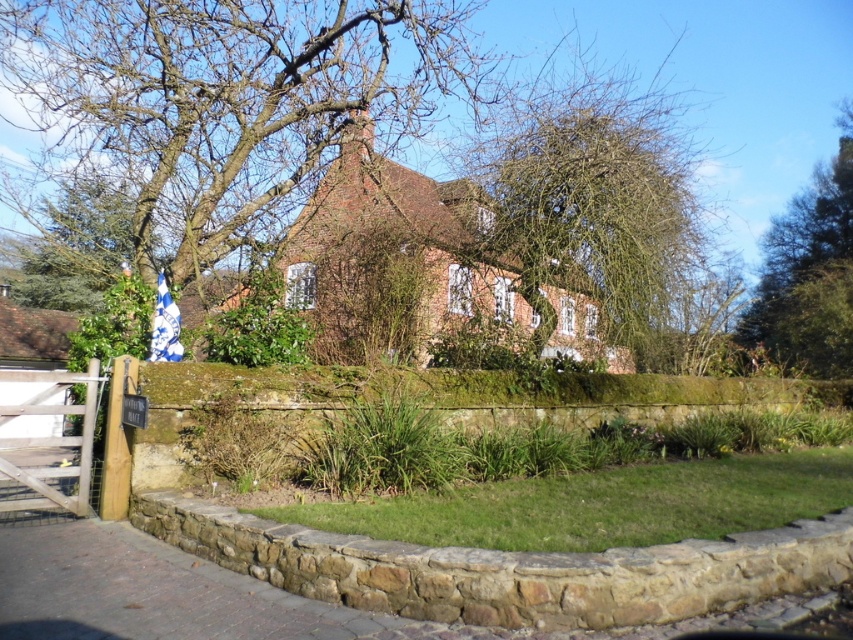
You are standing in front of the traditional brick house and notice two sets of branches. The first is the bare branches at upper center, and the second is the bare branches at center. Which of these two branches is taller?

The bare branches at center are taller than the bare branches at upper center.

You are a gardener standing in the paved area in front of the house. You notice two trees in the scene. Which tree, the bare branches at center or the green leafy tree at upper right, is positioned higher up in the image?

The bare branches at center is located above the green leafy tree at upper right, so the bare branches at center is positioned higher up in the image.